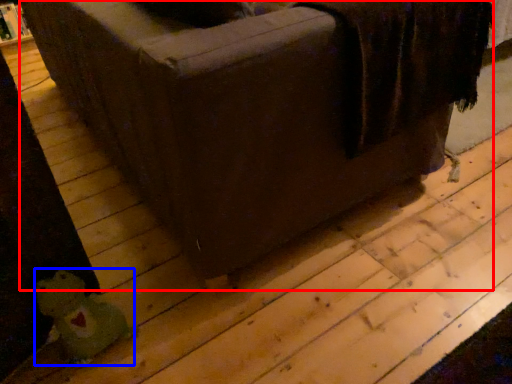
Question: Which point is further to the camera, furniture (highlighted by a red box) or toy (highlighted by a blue box)?

Choices:
 (A) furniture
 (B) toy

Answer: (B)